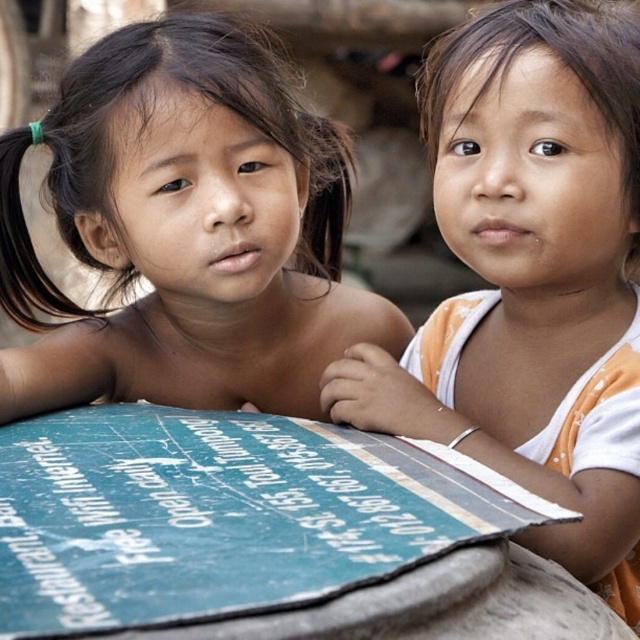
You are a photographer standing 5 meters away from the smooth skin child at center. Can you reach them without moving closer?

The smooth skin child at center is 4.59 meters away from you, so yes, you can reach them without moving closer since you are already within the 5 meters distance.

You are a photographer adjusting the focus on your camera. You want to ensure that both the smooth skin child at center and the matte orange tank top at center are in focus. Which object should you focus on first to achieve this?

The smooth skin child at center is positioned over the matte orange tank top at center, so focusing on the smooth skin child at center first will ensure both are in focus.

You are a photographer trying to capture both the smooth skin child at center and the matte orange tank top at center in a single frame. Based on their heights, which object should you adjust your camera angle to focus on first?

The smooth skin child at center is shorter than the matte orange tank top at center, so you should adjust your camera angle to focus on the smooth skin child at center first to ensure both are in frame.